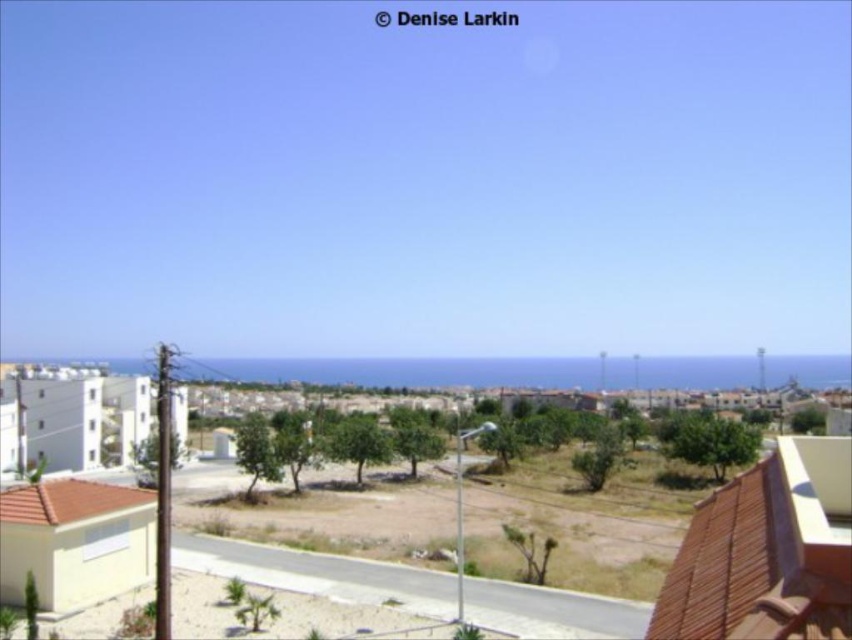
Does brown tile balcony at lower right appear under blue ocean at center?

Actually, brown tile balcony at lower right is above blue ocean at center.

Who is shorter, brown tile balcony at lower right or blue ocean at center?

brown tile balcony at lower right

Is point (700, 605) farther from viewer compared to point (462, 358)?

That is False.

Find the location of a particular element. The width and height of the screenshot is (852, 640). brown tile balcony at lower right is located at coordinates (766, 552).